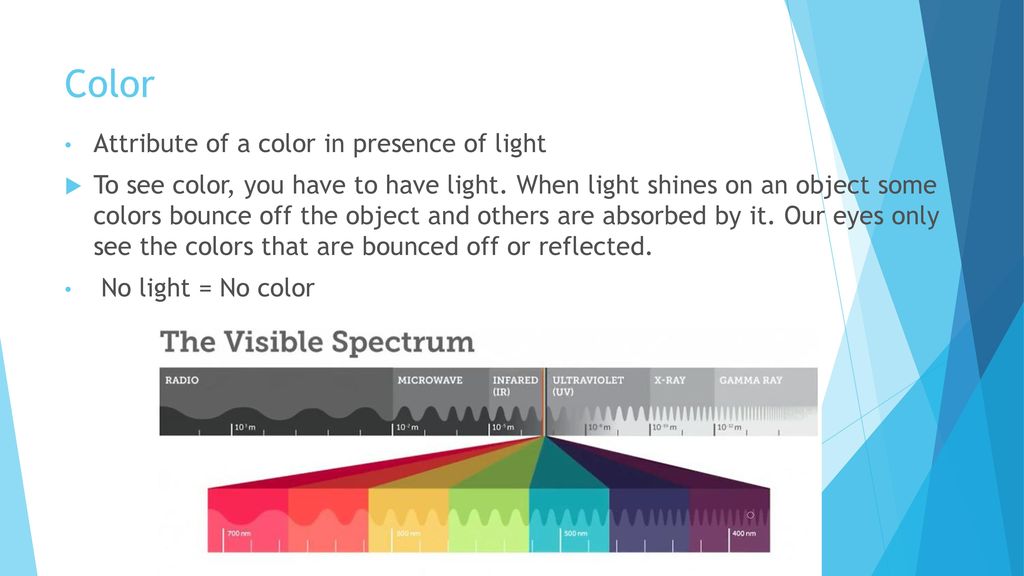
Where is `radio section of bar`? radio section of bar is located at coordinates (262, 385).